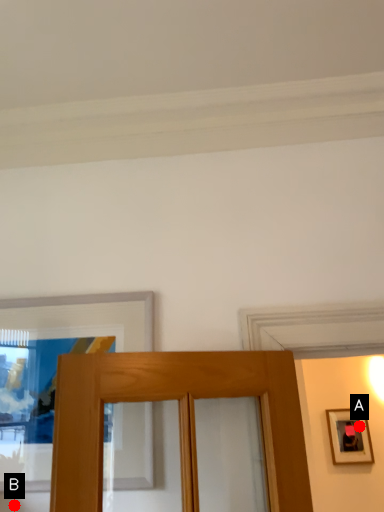
Question: Two points are circled on the image, labeled by A and B beside each circle. Which point appears closest to the camera in this image?

Choices:
 (A) A is closer
 (B) B is closer

Answer: (B)